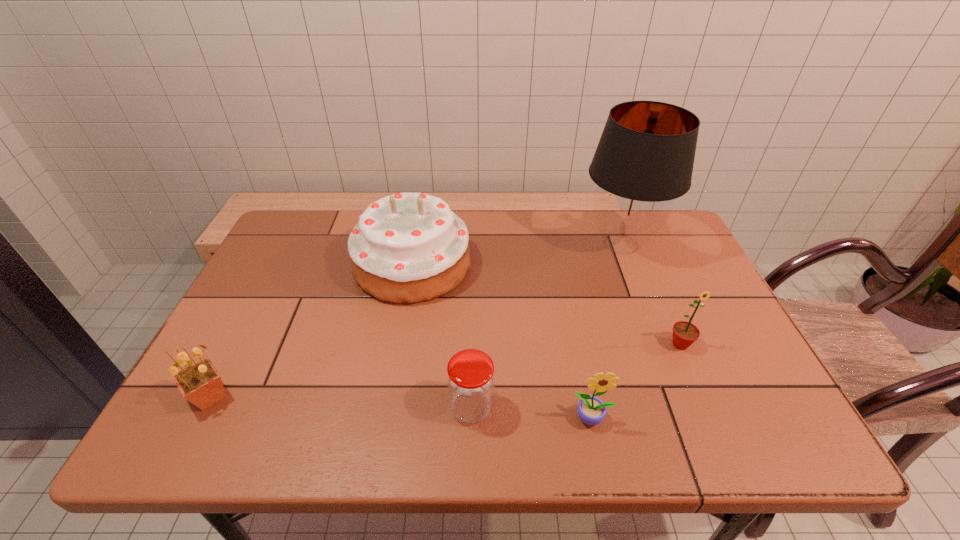
This screenshot has height=540, width=960. In order to click on vacant space located at the front of the leftmost sunflower with flowers visible in this screenshot , I will do `click(345, 396)`.

Identify the location of vacant region located 0.100m on the back of the shortest object. (472, 352).

The image size is (960, 540). What are the coordinates of `lampshade located in the far edge section of the desktop` in the screenshot? It's located at (644, 159).

You are a GUI agent. You are given a task and a screenshot of the screen. Output one action in this format:
    pyautogui.click(x=<x>, y=<y>)
    Task: Click on the cake situated at the far edge
    
    Given the screenshot: What is the action you would take?
    407,248

Identify the location of jar present at the near edge. (470, 379).

Find the location of a particular element. The image size is (960, 540). object that is at the left edge is located at coordinates (200, 383).

Where is `lampshade situated at the right edge`? The width and height of the screenshot is (960, 540). lampshade situated at the right edge is located at coordinates (644, 159).

Locate an element on the screen. This screenshot has width=960, height=540. sunflower that is at the right edge is located at coordinates (685, 333).

Where is `object at the near left corner`? Image resolution: width=960 pixels, height=540 pixels. object at the near left corner is located at coordinates (200, 383).

Locate an element on the screen. object present at the far right corner is located at coordinates (644, 159).